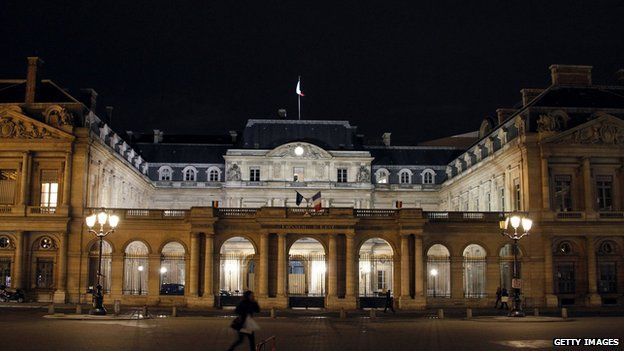
Find the location of a particular element. The image size is (624, 351). decorative molding is located at coordinates (x=29, y=131).